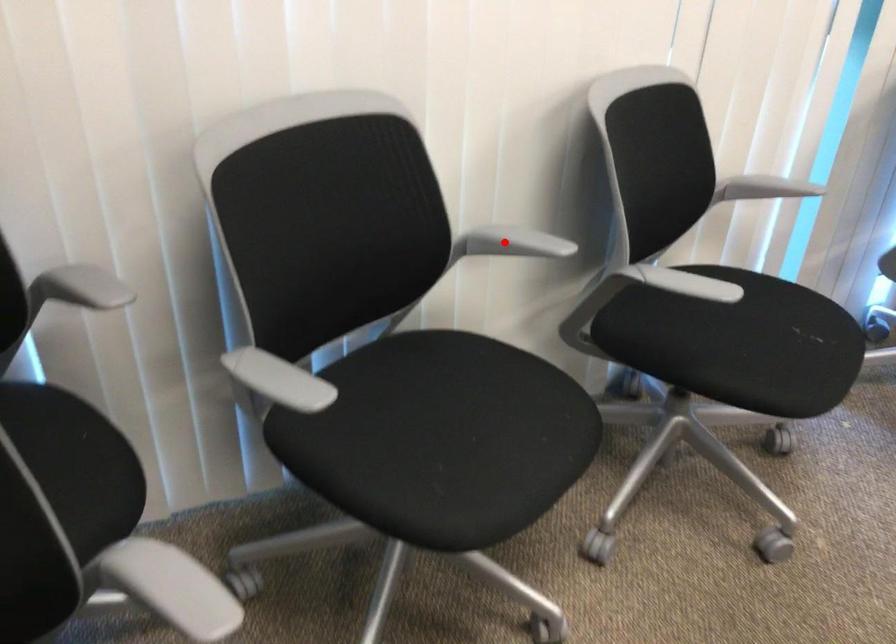
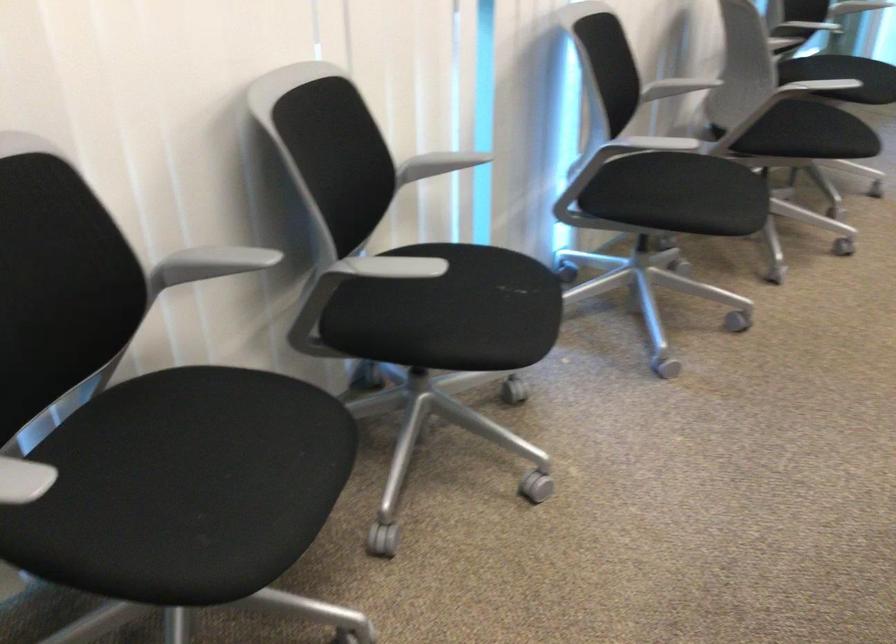
Where in the second image is the point corresponding to the highlighted location from the first image?

(211, 263)